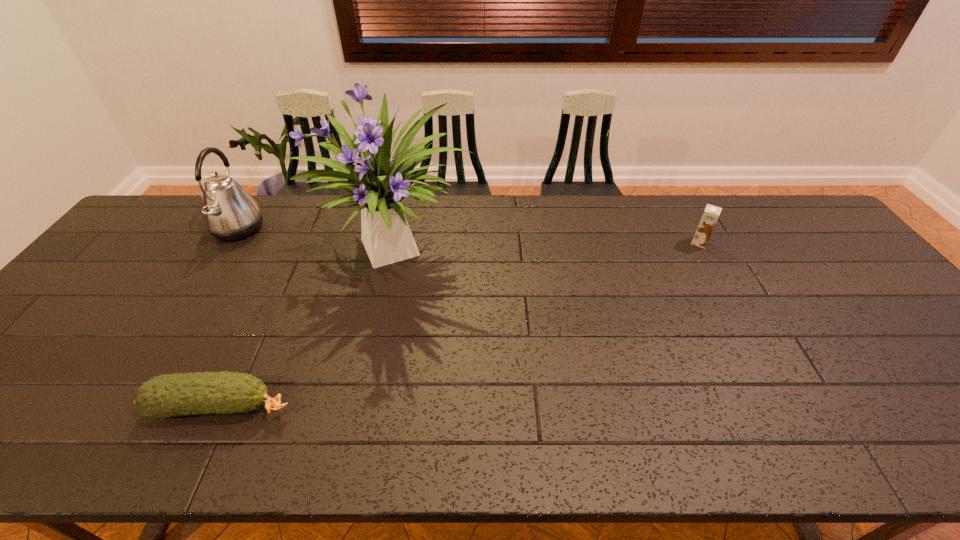
The width and height of the screenshot is (960, 540). I want to click on vacant point located between the third shortest object and the tallest object, so click(x=318, y=240).

You are a GUI agent. You are given a task and a screenshot of the screen. Output one action in this format:
    pyautogui.click(x=<x>, y=<y>)
    Task: Click on the unoccupied area between the chocolate milk and the second tallest object
    This screenshot has height=540, width=960.
    Given the screenshot: What is the action you would take?
    pyautogui.click(x=468, y=236)

Identify the location of vacant area that lies between the second tallest object and the tallest object. tap(318, 240).

Image resolution: width=960 pixels, height=540 pixels. Identify the location of free space that is in between the flower arrangement and the kettle. (318, 240).

Identify the location of unoccupied area between the shortest object and the second shortest object. (461, 325).

Locate an element on the screen. The height and width of the screenshot is (540, 960). unoccupied area between the kettle and the tallest object is located at coordinates (318, 240).

I want to click on free space between the rightmost object and the flower arrangement, so click(x=549, y=247).

Identify the location of empty location between the third tallest object and the flower arrangement. The height and width of the screenshot is (540, 960). (549, 247).

The image size is (960, 540). I want to click on object that can be found as the third closest to the shortest object, so [x=710, y=216].

Find the location of `object that stands as the closest to the shortest object`. object that stands as the closest to the shortest object is located at coordinates (380, 184).